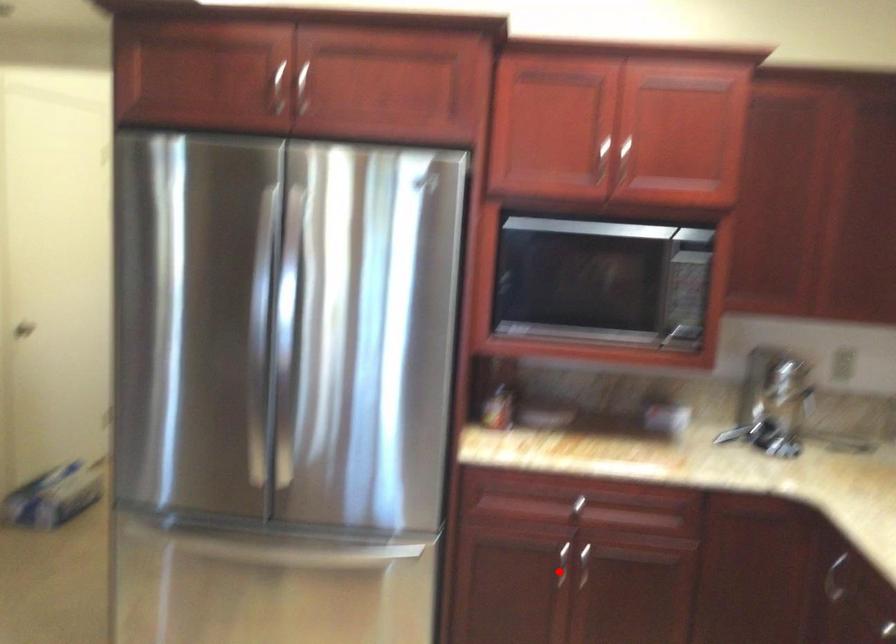
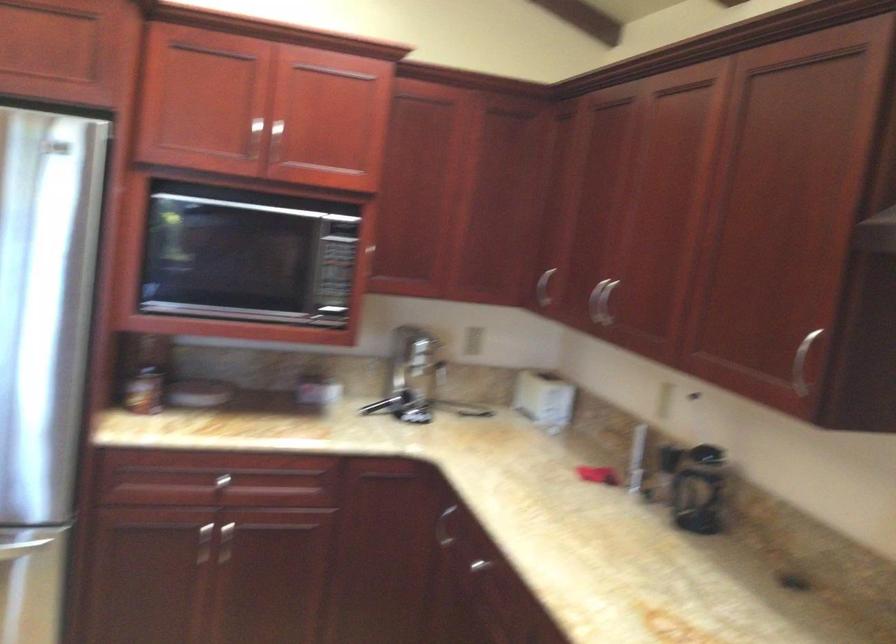
Where in the second image is the point corresponding to the highlighted location from the first image?

(203, 544)